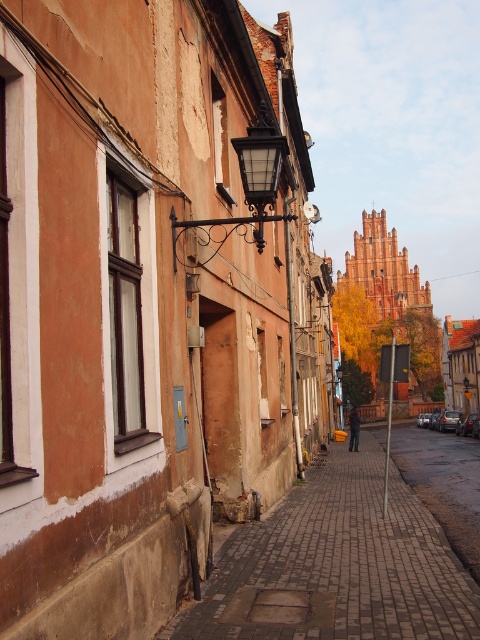
You are standing on the cobblestone street in the historic town and notice two points marked in the scene. The first point is at coordinates point [335,550] and the second is at point [475,497]. Which of these two points is closer to your current position?

Point [335,550] is closer to the camera than point [475,497], so the first point is closer to your current position.

You are a delivery person trying to navigate through the narrow cobblestone street. You notice two sections of the sidewalk labeled as brick paved sidewalk at center and brick sidewalk at center. Which section should you avoid stepping on if you want to prevent tripping?

The brick paved sidewalk at center has a lesser height compared to brick sidewalk at center, so you should avoid stepping on the brick paved sidewalk at center to prevent tripping due to the height difference.